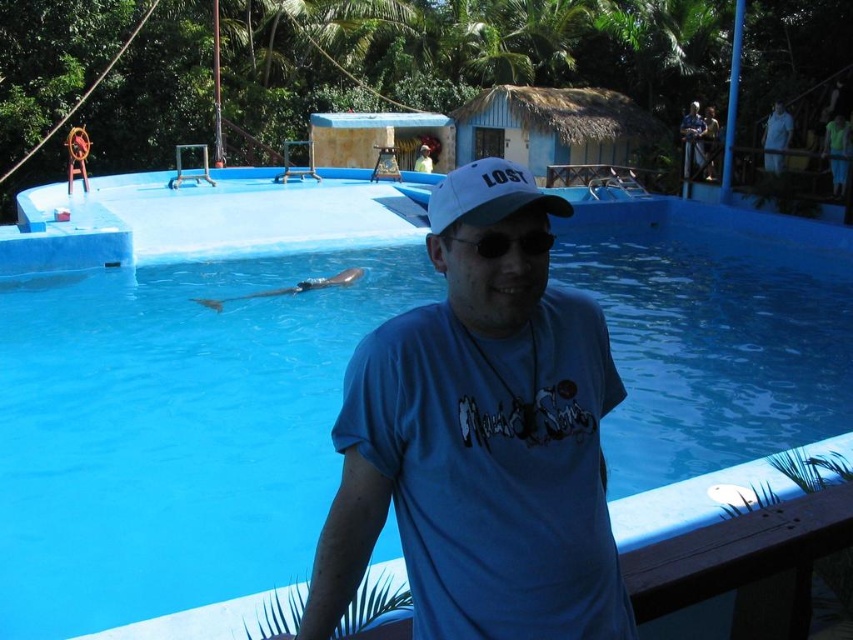
You are standing at the edge of the pool and want to locate the blue smooth water at center. According to the coordinates provided, where exactly would you find it?

The blue smooth water at center is located at point coordinates of 0.636 on the x axis and 0.211 on the y axis.

You are a photographer trying to capture a clear shot of the blue cotton shirt at center and the black plastic goggles at center. Since you want both items to appear equally sized in the photo, which object should you move closer to the camera?

Since the blue cotton shirt at center is bigger than the black plastic goggles at center, you should move the black plastic goggles at center closer to the camera to make them appear the same size in the photo.

You are a photographer planning to capture a wide shot of the blue smooth water at center and the blue cotton shirt at center. Based on their sizes, which object would require more space in the frame to fully capture its width?

The blue smooth water at center requires more space in the frame because its width surpasses that of the blue cotton shirt at center.